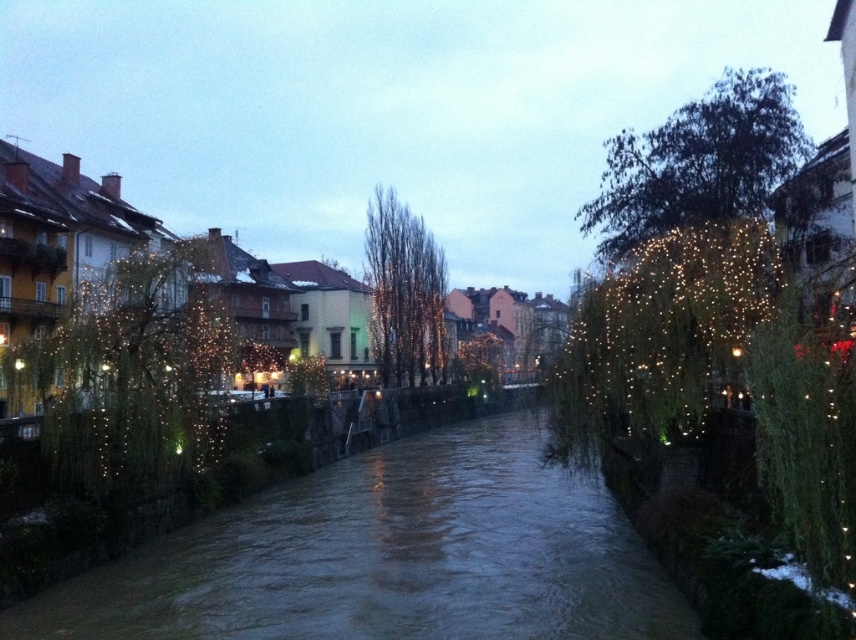
Between illuminated string lights at center and green leafy tree at upper right, which one is positioned higher?

green leafy tree at upper right is above.

You are a GUI agent. You are given a task and a screenshot of the screen. Output one action in this format:
    pyautogui.click(x=<x>, y=<y>)
    Task: Click on the illuminated string lights at center
    The height and width of the screenshot is (640, 856).
    Given the screenshot: What is the action you would take?
    pyautogui.click(x=58, y=236)

This screenshot has height=640, width=856. I want to click on illuminated string lights at center, so click(x=58, y=236).

Is illuminated willow tree at center-right below illuminated string lights at center?

No.

Is illuminated willow tree at center-right above illuminated string lights at center?

Correct, illuminated willow tree at center-right is located above illuminated string lights at center.

The width and height of the screenshot is (856, 640). Describe the element at coordinates (660, 339) in the screenshot. I see `illuminated willow tree at center-right` at that location.

At what (x,y) coordinates should I click in order to perform the action: click on illuminated willow tree at center-right. Please return your answer as a coordinate pair (x, y). This screenshot has height=640, width=856. Looking at the image, I should click on (660, 339).

Can you confirm if brown water at center is positioned to the right of illuminated wire at left?

Yes, brown water at center is to the right of illuminated wire at left.

Looking at this image, is brown water at center closer to camera compared to illuminated wire at left?

Yes.

Is point (492, 532) positioned after point (173, 365)?

That is True.

This screenshot has height=640, width=856. In order to click on brown water at center in this screenshot , I will do `click(387, 557)`.